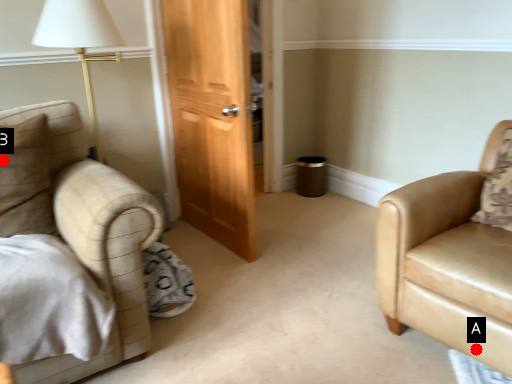
Question: Two points are circled on the image, labeled by A and B beside each circle. Which point is farther from the camera taking this photo?

Choices:
 (A) A is further
 (B) B is further

Answer: (B)